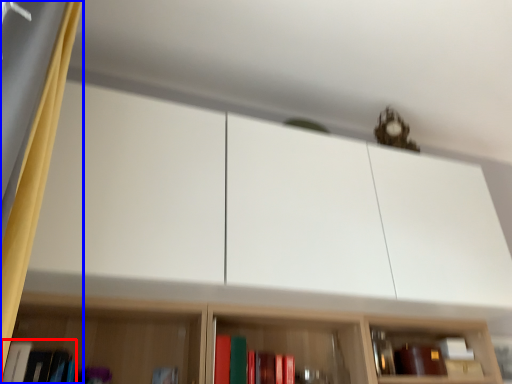
Question: Among these objects, which one is nearest to the camera, book (highlighted by a red box) or curtain (highlighted by a blue box)?

Choices:
 (A) book
 (B) curtain

Answer: (B)